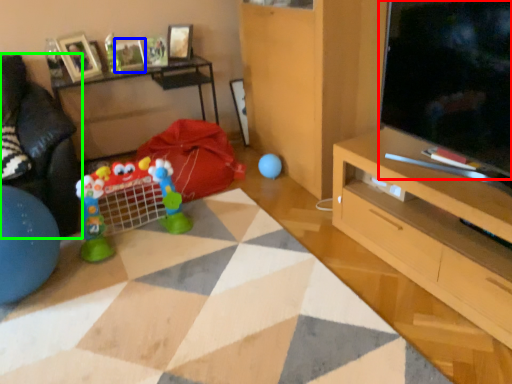
Question: Which is nearer to the television (highlighted by a red box)? picture frame (highlighted by a blue box) or studio couch (highlighted by a green box).

Choices:
 (A) picture frame
 (B) studio couch

Answer: (B)